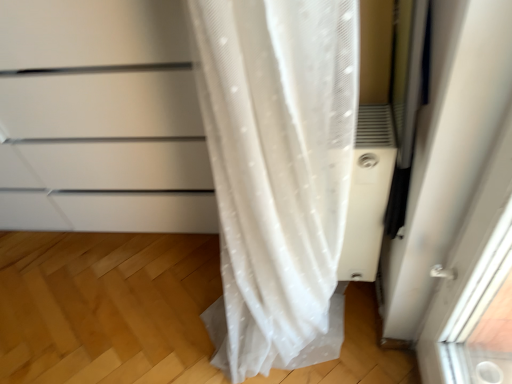
Where is `white plastic air conditioner at right`? The width and height of the screenshot is (512, 384). white plastic air conditioner at right is located at coordinates (368, 193).

What do you see at coordinates (368, 193) in the screenshot?
I see `white plastic air conditioner at right` at bounding box center [368, 193].

Measure the distance between point (10,131) and camera.

3.87 feet.

Find the location of `white matte cabinet at left`. white matte cabinet at left is located at coordinates [x=101, y=119].

Describe the element at coordinates (101, 119) in the screenshot. I see `white matte cabinet at left` at that location.

Find the location of a particular element. white plastic air conditioner at right is located at coordinates (368, 193).

Considering the relative positions of white plastic air conditioner at right and white matte cabinet at left in the image provided, is white plastic air conditioner at right to the right of white matte cabinet at left from the viewer's perspective?

Yes, white plastic air conditioner at right is to the right of white matte cabinet at left.

Is white plastic air conditioner at right positioned behind white matte cabinet at left?

Yes, white plastic air conditioner at right is further from the camera.

Which is nearer, (377, 173) or (28, 212)?

Point (377, 173) appears to be closer to the viewer than point (28, 212).

From the image's perspective, would you say white plastic air conditioner at right is positioned over white matte cabinet at left?

No, from the image's perspective, white plastic air conditioner at right is not on top of white matte cabinet at left.

From a real-world perspective, who is located higher, white plastic air conditioner at right or white matte cabinet at left?

From a 3D spatial view, white matte cabinet at left is above.

Looking at this image, in terms of width, does white plastic air conditioner at right look wider or thinner when compared to white matte cabinet at left?

white plastic air conditioner at right is thinner than white matte cabinet at left.

Considering the sizes of objects white plastic air conditioner at right and white matte cabinet at left in the image provided, who is taller, white plastic air conditioner at right or white matte cabinet at left?

white matte cabinet at left.

Is white plastic air conditioner at right bigger or smaller than white matte cabinet at left?

Clearly, white plastic air conditioner at right is smaller in size than white matte cabinet at left.

Do you think white plastic air conditioner at right is within white matte cabinet at left, or outside of it?

The correct answer is: outside.

Based on the photo, is white plastic air conditioner at right not close to white matte cabinet at left?

white plastic air conditioner at right is actually quite close to white matte cabinet at left.

Is white plastic air conditioner at right oriented away from white matte cabinet at left?

No.

How many degrees apart are the facing directions of white plastic air conditioner at right and white matte cabinet at left?

white plastic air conditioner at right and white matte cabinet at left are facing 1.32 degrees away from each other.

The image size is (512, 384). What are the coordinates of `air conditioner behind the white matte cabinet at left` in the screenshot? It's located at (368, 193).

Considering the positions of objects white matte cabinet at left and white plastic air conditioner at right in the image provided, who is more to the right, white matte cabinet at left or white plastic air conditioner at right?

white plastic air conditioner at right is more to the right.

Between white matte cabinet at left and white plastic air conditioner at right, which one is positioned behind?

white plastic air conditioner at right is behind.

Which is closer, (166, 198) or (354, 199)?

Point (166, 198) is positioned farther from the camera compared to point (354, 199).

From the image's perspective, is white matte cabinet at left below white plastic air conditioner at right?

Actually, white matte cabinet at left appears above white plastic air conditioner at right in the image.

From a real-world perspective, which object rests below the other?

white plastic air conditioner at right.

Which object is thinner, white matte cabinet at left or white plastic air conditioner at right?

white plastic air conditioner at right.

Which of these two, white matte cabinet at left or white plastic air conditioner at right, stands taller?

With more height is white matte cabinet at left.

Does white matte cabinet at left have a larger size compared to white plastic air conditioner at right?

Yes.

Is white matte cabinet at left not inside white plastic air conditioner at right?

white matte cabinet at left lies outside white plastic air conditioner at right's area.

From the picture: Is white matte cabinet at left beside white plastic air conditioner at right?

white matte cabinet at left is not next to white plastic air conditioner at right, and they're not touching.

From the picture: Is white matte cabinet at left turned away from white plastic air conditioner at right?

That's not correct — white matte cabinet at left is not looking away from white plastic air conditioner at right.

Looking at this image, can you tell me how much white matte cabinet at left and white plastic air conditioner at right differ in facing direction?

They differ by 1.32 degrees in their facing directions.

Measure the distance from white matte cabinet at left to white plastic air conditioner at right.

25.47 inches.

Where is `air conditioner below the white matte cabinet at left (from a real-world perspective)`? air conditioner below the white matte cabinet at left (from a real-world perspective) is located at coordinates [x=368, y=193].

This screenshot has height=384, width=512. In order to click on air conditioner located on the right of white matte cabinet at left in this screenshot , I will do `click(368, 193)`.

In order to click on cabinetry located above the white plastic air conditioner at right (from the image's perspective) in this screenshot , I will do `click(101, 119)`.